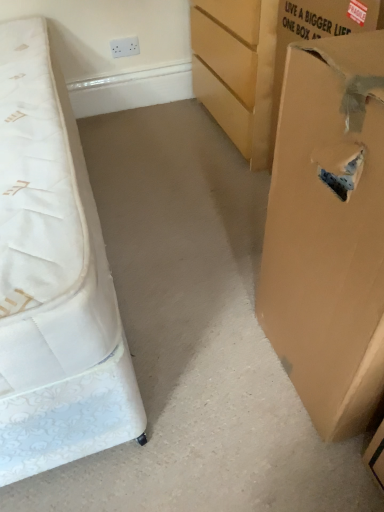
Question: Is brown cardboard box at right, marked as the first cardboard box in a bottom-to-top arrangement, to the left or to the right of white quilted mattress at left in the image?

Choices:
 (A) right
 (B) left

Answer: (A)

Question: From a real-world perspective, is brown cardboard box at right, the 1th cardboard box from the front, physically located above or below white quilted mattress at left?

Choices:
 (A) above
 (B) below

Answer: (A)

Question: Based on their relative distances, which object is farther from the brown cardboard box at right, the 2th cardboard box in the back-to-front sequence?

Choices:
 (A) white quilted mattress at left
 (B) brown cardboard box at right, which ranks as the second cardboard box in bottom-to-top order

Answer: (B)

Question: Which object is the closest to the brown cardboard box at right, which ranks as the second cardboard box in bottom-to-top order?

Choices:
 (A) white quilted mattress at left
 (B) brown cardboard box at right, acting as the 2th cardboard box starting from the top

Answer: (B)